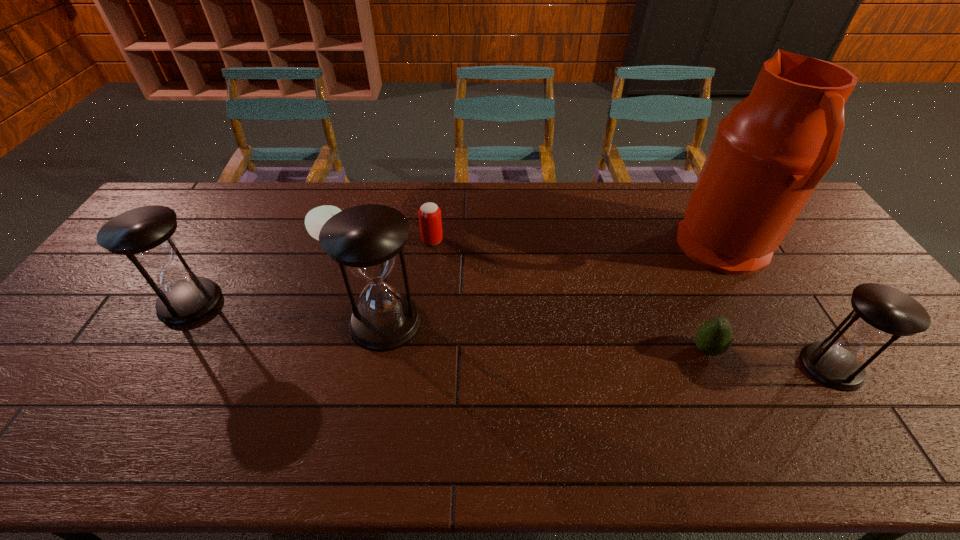
Image resolution: width=960 pixels, height=540 pixels. In order to click on free space located 0.240m on the back of the second hourglass from right to left in this screenshot , I will do `click(401, 239)`.

You are a GUI agent. You are given a task and a screenshot of the screen. Output one action in this format:
    pyautogui.click(x=<x>, y=<y>)
    Task: Click on the vacant space located 0.210m on the back of the fourth shortest object
    
    Given the screenshot: What is the action you would take?
    pyautogui.click(x=778, y=284)

The width and height of the screenshot is (960, 540). In order to click on vacant space located on the left of the beer can in this screenshot , I will do `click(337, 240)`.

Locate an element on the screen. This screenshot has width=960, height=540. vacant area located 0.190m from the spout of the water jug is located at coordinates (618, 249).

Locate an element on the screen. This screenshot has height=540, width=960. vacant region located 0.230m from the spout of the water jug is located at coordinates (606, 249).

Locate an element on the screen. The height and width of the screenshot is (540, 960). vacant area located 0.330m from the spout of the water jug is located at coordinates (573, 249).

At what (x,y) coordinates should I click in order to perform the action: click on free region located on the front of the sixth object from right to left. Please return your answer as a coordinate pair (x, y). This screenshot has height=540, width=960. Looking at the image, I should click on (321, 266).

Image resolution: width=960 pixels, height=540 pixels. Find the location of `vacant area situated on the back of the third object from right to left`. vacant area situated on the back of the third object from right to left is located at coordinates (692, 316).

This screenshot has width=960, height=540. I want to click on object present at the far edge, so click(x=770, y=152).

The width and height of the screenshot is (960, 540). I want to click on object that is at the near edge, so (880, 313).